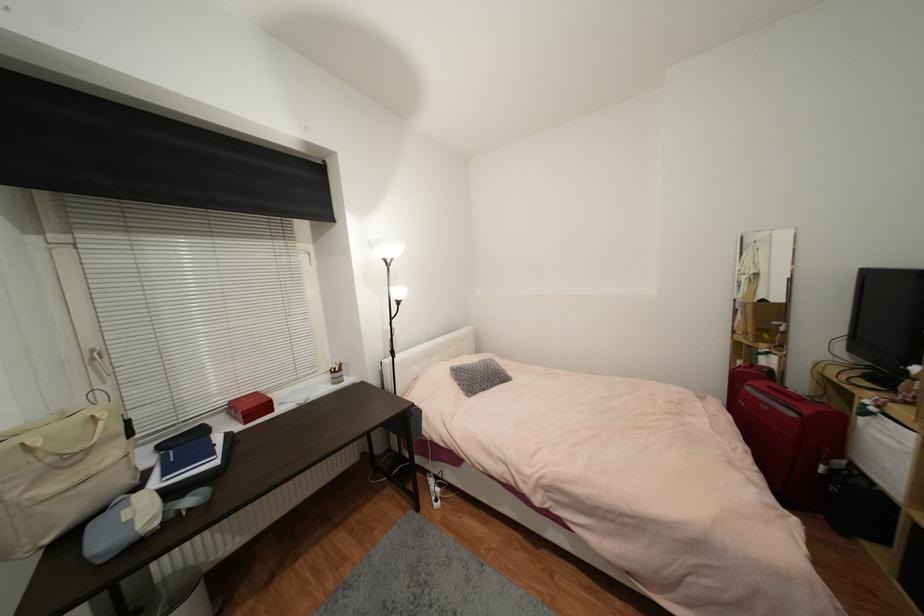
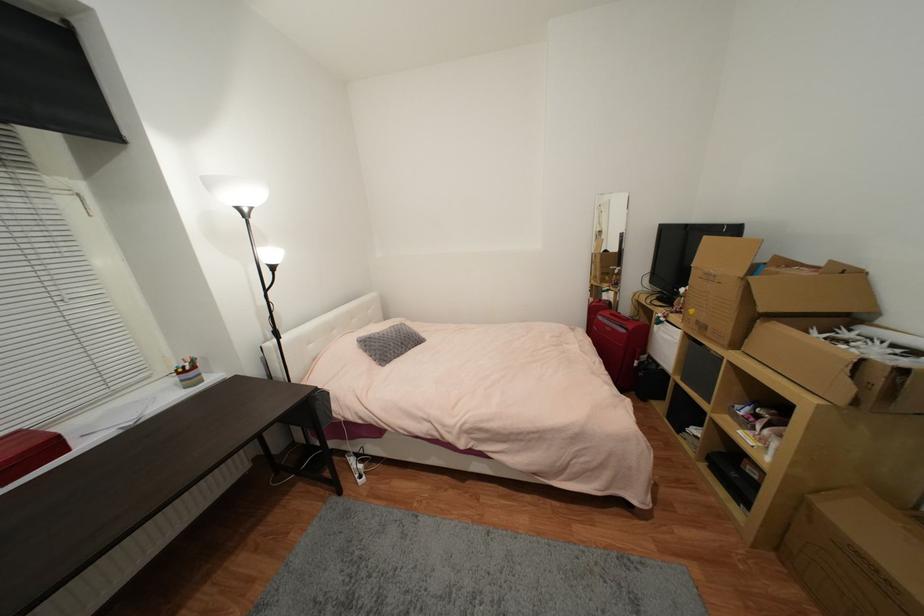
Find the pixel in the second image that matches [397,358] in the first image.

(283, 339)